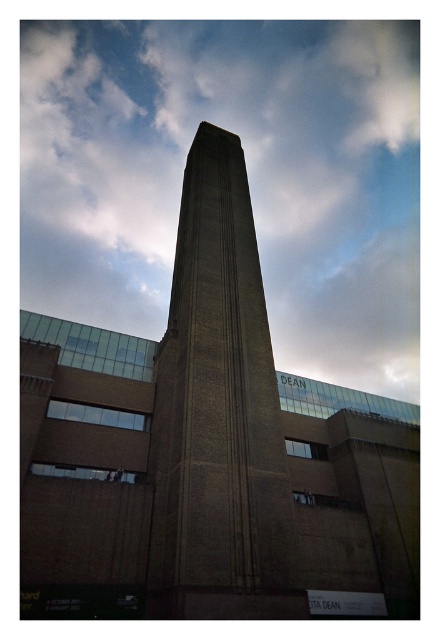
You are an architect analyzing the image. You need to determine the spatial relationship between the cloudy sky at upper center and the brown stone tower at center. Based on the scene, which object is positioned higher in the image?

The cloudy sky at upper center is located above the brown stone tower at center, so it is positioned higher in the image.

You are standing in front of the building and looking up at the tower. There is a point marked at coordinates [248,173]. Based on the scene description, where is this point located?

The point is located on the cloudy sky at upper center.

You are an architect analyzing the image. You need to determine if the cloudy sky at upper center can cover the brown stone tower at center if it moves downward. Can you confirm this possibility based on their widths?

The cloudy sky at upper center might be wider than brown stone tower at center, so it could potentially cover the tower if it moves downward, depending on their exact dimensions and positioning.